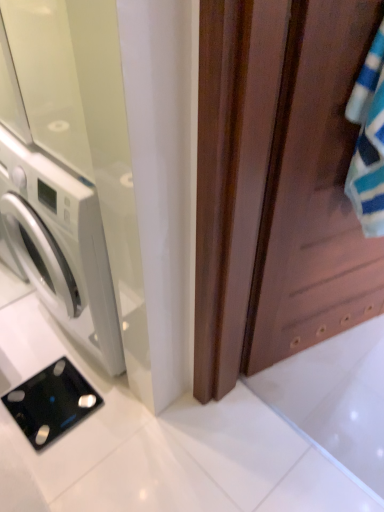
Question: From the image's perspective, is white glossy door at left, arranged as the 1th screen door when viewed from the left, positioned above or below black glass scale at lower left?

Choices:
 (A) above
 (B) below

Answer: (A)

Question: From a real-world perspective, is white glossy door at left, the 2th screen door in the right-to-left sequence, positioned above or below black glass scale at lower left?

Choices:
 (A) above
 (B) below

Answer: (A)

Question: Estimate the real-world distances between objects in this image. Which object is closer to the white glossy door at left, the 2th screen door in the right-to-left sequence?

Choices:
 (A) black glass scale at lower left
 (B) brown wooden screen door at right, the first screen door in the right-to-left sequence

Answer: (B)

Question: Which of these objects is positioned farthest from the black glass scale at lower left?

Choices:
 (A) brown wooden screen door at right, placed as the 2th screen door when sorted from left to right
 (B) white glossy door at left, the 2th screen door in the right-to-left sequence

Answer: (A)